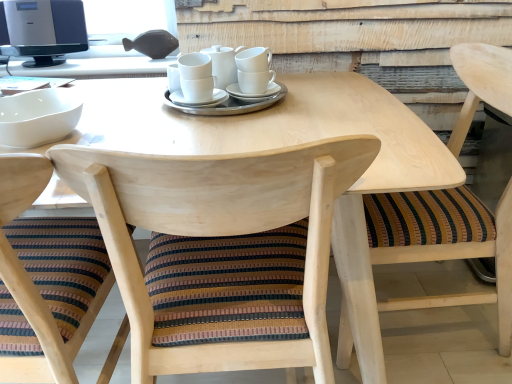
Question: From a real-world perspective, is satin black monitor at upper left located beneath white ceramic cups at center?

Choices:
 (A) yes
 (B) no

Answer: (B)

Question: Can you confirm if satin black monitor at upper left is positioned to the right of white ceramic cups at center?

Choices:
 (A) no
 (B) yes

Answer: (A)

Question: Does satin black monitor at upper left turn towards white ceramic cups at center?

Choices:
 (A) yes
 (B) no

Answer: (B)

Question: Would you say white ceramic cups at center is part of satin black monitor at upper left's contents?

Choices:
 (A) yes
 (B) no

Answer: (B)

Question: Does satin black monitor at upper left have a larger size compared to white ceramic cups at center?

Choices:
 (A) no
 (B) yes

Answer: (B)

Question: Is satin black monitor at upper left outside white ceramic cups at center?

Choices:
 (A) yes
 (B) no

Answer: (A)

Question: Can white glossy bowl at left be found inside wooden chair with striped cushion at lower left, the 3th chair positioned from the right?

Choices:
 (A) yes
 (B) no

Answer: (A)

Question: Can you confirm if wooden chair with striped cushion at lower left, marked as the 1th chair in a left-to-right arrangement, is taller than white glossy bowl at left?

Choices:
 (A) yes
 (B) no

Answer: (A)

Question: Does wooden chair with striped cushion at lower left, the 3th chair positioned from the right, appear on the right side of white glossy bowl at left?

Choices:
 (A) yes
 (B) no

Answer: (B)

Question: Is wooden chair with striped cushion at lower left, the 3th chair positioned from the right, further to the viewer compared to white glossy bowl at left?

Choices:
 (A) no
 (B) yes

Answer: (A)

Question: From the image's perspective, is wooden chair with striped cushion at lower left, marked as the 1th chair in a left-to-right arrangement, beneath white glossy bowl at left?

Choices:
 (A) yes
 (B) no

Answer: (A)

Question: Is wooden chair with striped cushion at lower left, the 3th chair positioned from the right, far from white glossy bowl at left?

Choices:
 (A) yes
 (B) no

Answer: (B)

Question: Are white ceramic cups at center and white ceramic saucer at center, the 2th saucer positioned from the right, beside each other?

Choices:
 (A) yes
 (B) no

Answer: (A)